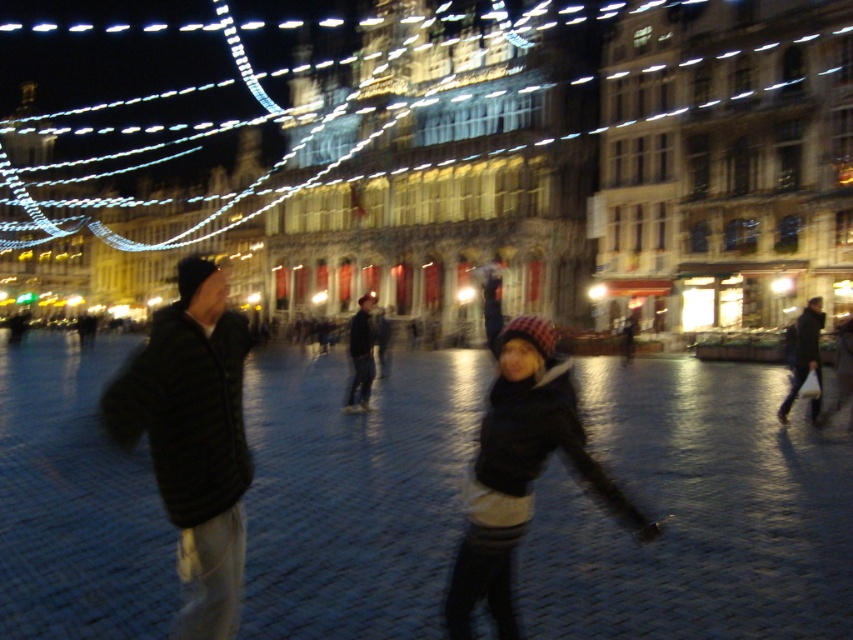
You are standing in the town square and want to move from the point at coordinates point [801,364] to the point at coordinates point [363,371]. Which direction should you move in?

You should move downward because point [801,364] is in front of point [363,371], meaning it is closer to the viewer. To reach the latter, you need to move towards the background, which corresponds to a downward direction in this perspective.

You are a photographer trying to capture both the black fuzzy jacket at left and the dark gray jacket at right in the same frame. Considering their heights, which jacket will appear larger in the photo?

The black fuzzy jacket at left will appear larger in the photo because it is much taller than the dark gray jacket at right.

In the scene shown: You are a photographer standing in the town square and want to take a photo of both the black fuzzy jacket at left and dark blue jeans at center. Given that your camera has a maximum focus range of 25 meters, will both subjects be in focus?

The black fuzzy jacket at left and dark blue jeans at center are 25.13 meters apart from each other. Since the distance between them exceeds the camera focus range of 25 meters, both subjects cannot be in focus simultaneously.